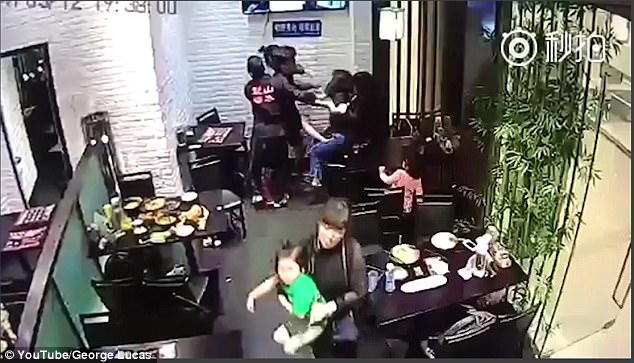
Find the location of a particular element. table is located at coordinates (424, 293), (201, 208), (11, 224), (222, 140).